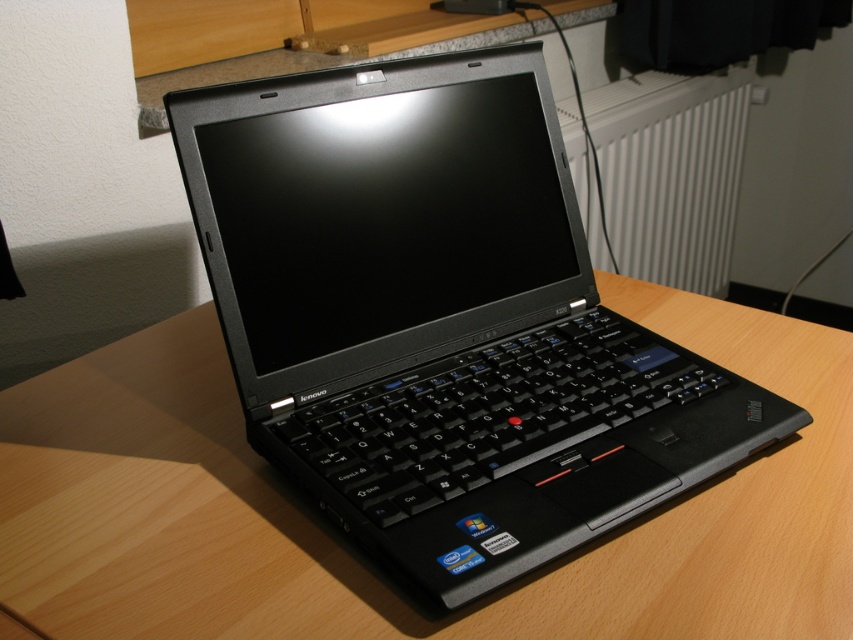
You are organizing a small event and need to place a 1.2 meter long banner on the wooden table at center. Can the banner fit on the table if the white plastic radiator at upper center is also occupying some space?

The wooden table at center might be wider than the white plastic radiator at upper center, but without knowing the exact dimensions of the table and radiator, it is uncertain whether the banner will fit. You should measure the available space on the table after accounting for the radiator to ensure the banner can be placed.

You are standing at the edge of the wooden desk and want to place a small object exactly at point (355, 552). Is this point located on the wooden desk?

Yes, the point (355, 552) is on the wooden desk at center, so placing the object there would be on the desk.

You are organizing your desk and want to make sure there is enough space for both the black plastic laptop at center and the white plastic radiator at upper center. Based on their sizes, which object takes up more desk space?

The white plastic radiator at upper center takes up more desk space than the black plastic laptop at center because the black plastic laptop at center occupies less space than the white plastic radiator at upper center.